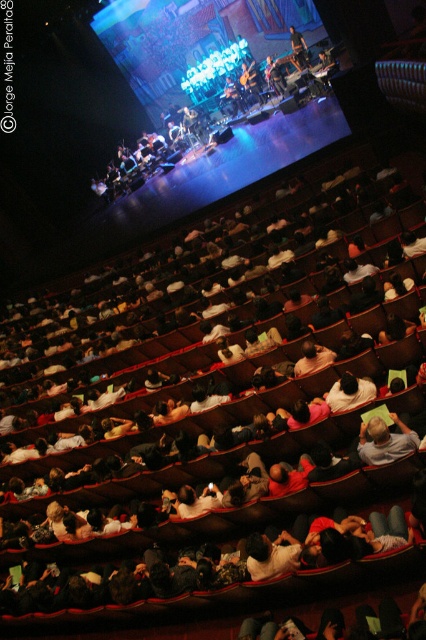
From the picture: Between light brown fabric shirt at lower right and shiny blue jacket at center, which one appears on the right side from the viewer's perspective?

shiny blue jacket at center is more to the right.

Is light brown fabric shirt at lower right to the right of shiny blue jacket at center from the viewer's perspective?

Incorrect, light brown fabric shirt at lower right is not on the right side of shiny blue jacket at center.

Is point (408, 428) closer to camera compared to point (290, 28)?

Yes.

Where is `light brown fabric shirt at lower right`? This screenshot has width=426, height=640. light brown fabric shirt at lower right is located at coordinates (385, 440).

Between dark gray fabric seat at center and light brown fabric shirt at lower right, which one appears on the left side from the viewer's perspective?

dark gray fabric seat at center is more to the left.

Is point (109, 547) closer to viewer compared to point (408, 440)?

That is False.

Who is more distant from viewer, (302, 534) or (379, 426)?

Positioned behind is point (302, 534).

Locate an element on the screen. dark gray fabric seat at center is located at coordinates (207, 460).

Does dark gray fabric seat at center have a greater width compared to shiny blue jacket at center?

In fact, dark gray fabric seat at center might be narrower than shiny blue jacket at center.

Find the location of a particular element. This screenshot has width=426, height=640. dark gray fabric seat at center is located at coordinates (207, 460).